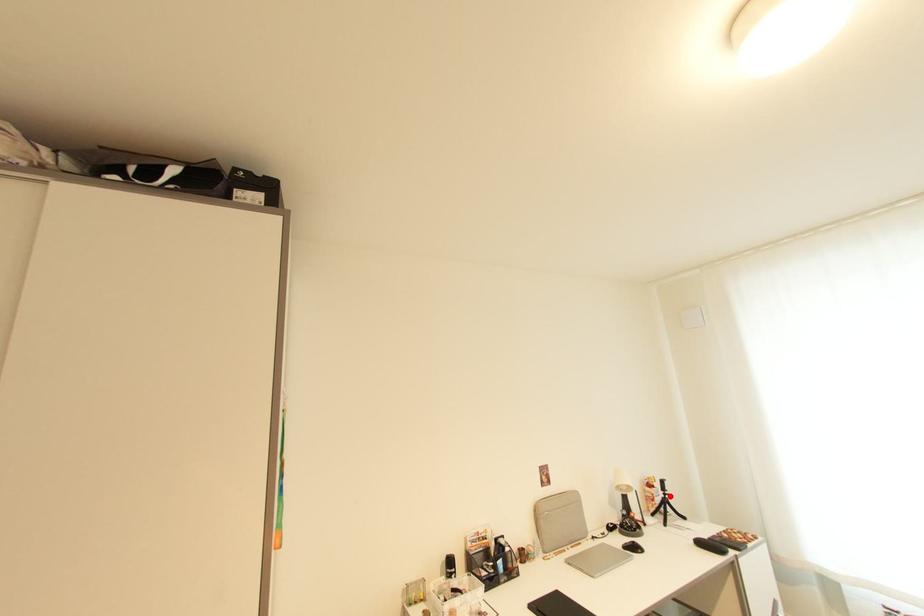
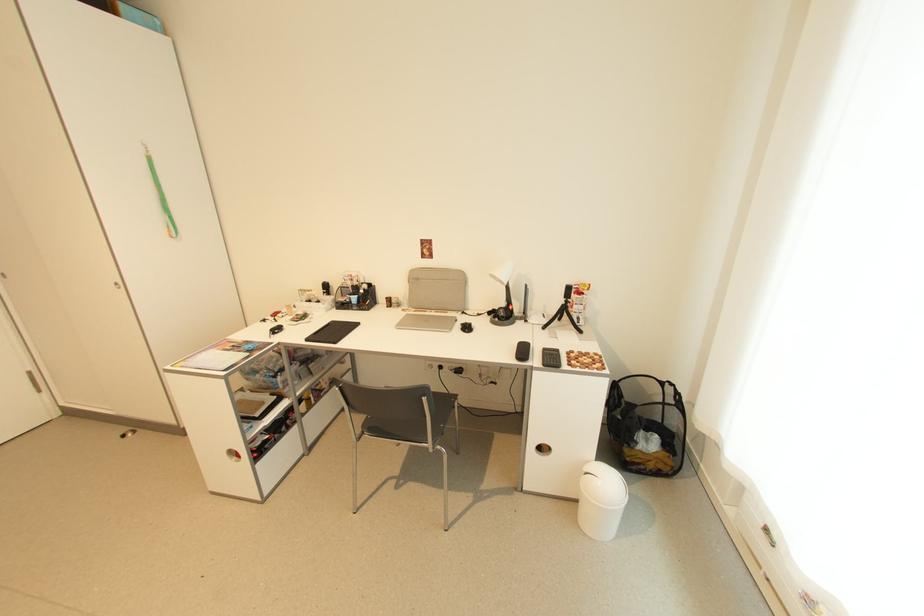
Where in the second image is the point corresponding to the highlighted location from the first image?

(572, 302)